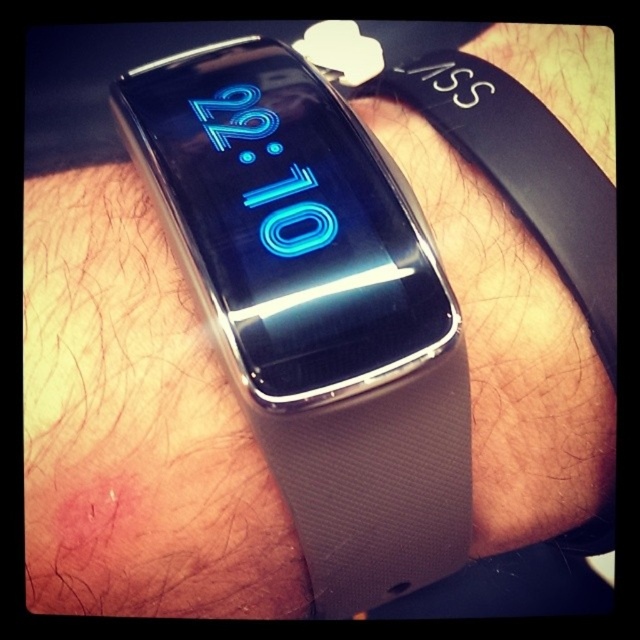
Between white fabric band at center and white fabric wristband at center, which one has more height?

Standing taller between the two is white fabric band at center.

This screenshot has width=640, height=640. Describe the element at coordinates (316, 307) in the screenshot. I see `white fabric band at center` at that location.

Which is in front, point (337, 593) or point (376, 77)?

Positioned in front is point (337, 593).

Where is `white fabric band at center`? The width and height of the screenshot is (640, 640). white fabric band at center is located at coordinates (316, 307).